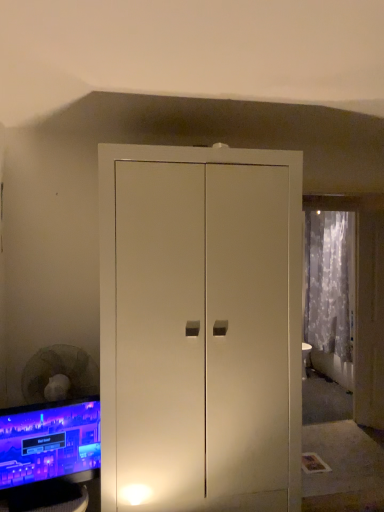
Locate an element on the screen. This screenshot has height=512, width=384. matte black monitor at lower left is located at coordinates (48, 453).

What do you see at coordinates (48, 453) in the screenshot? I see `matte black monitor at lower left` at bounding box center [48, 453].

Measure the distance between point (316, 320) and camera.

Point (316, 320) and camera are 5.34 meters apart.

Find the location of `translucent fabric curtain at right`. translucent fabric curtain at right is located at coordinates (328, 281).

What do you see at coordinates (328, 281) in the screenshot?
I see `translucent fabric curtain at right` at bounding box center [328, 281].

This screenshot has height=512, width=384. In order to click on matte black monitor at lower left in this screenshot , I will do `click(48, 453)`.

Which is more to the right, translucent fabric curtain at right or matte black monitor at lower left?

Positioned to the right is translucent fabric curtain at right.

In the scene shown: Is translucent fabric curtain at right in front of or behind matte black monitor at lower left in the image?

translucent fabric curtain at right is behind matte black monitor at lower left.

Which is behind, point (348, 346) or point (76, 443)?

The point (348, 346) is behind.

From the image's perspective, which is above, translucent fabric curtain at right or matte black monitor at lower left?

translucent fabric curtain at right.

From a real-world perspective, is translucent fabric curtain at right physically located above or below matte black monitor at lower left?

In terms of real-world spatial position, translucent fabric curtain at right is above matte black monitor at lower left.

Can you confirm if translucent fabric curtain at right is wider than matte black monitor at lower left?

Yes, translucent fabric curtain at right is wider than matte black monitor at lower left.

Considering the sizes of translucent fabric curtain at right and matte black monitor at lower left in the image, is translucent fabric curtain at right taller or shorter than matte black monitor at lower left?

translucent fabric curtain at right is taller than matte black monitor at lower left.

Who is smaller, translucent fabric curtain at right or matte black monitor at lower left?

Smaller between the two is matte black monitor at lower left.

Can we say translucent fabric curtain at right lies outside matte black monitor at lower left?

Indeed, translucent fabric curtain at right is completely outside matte black monitor at lower left.

Is translucent fabric curtain at right not close to matte black monitor at lower left?

Yes.

Is translucent fabric curtain at right looking in the opposite direction of matte black monitor at lower left?

translucent fabric curtain at right is not turned away from matte black monitor at lower left.

Looking at this image, can you tell me how much translucent fabric curtain at right and matte black monitor at lower left differ in facing direction?

102 degrees separate the facing orientations of translucent fabric curtain at right and matte black monitor at lower left.

This screenshot has height=512, width=384. I want to click on curtain that appears on the right of matte black monitor at lower left, so click(x=328, y=281).

Is matte black monitor at lower left to the right of translucent fabric curtain at right from the viewer's perspective?

In fact, matte black monitor at lower left is to the left of translucent fabric curtain at right.

Considering their positions, is matte black monitor at lower left located in front of or behind translucent fabric curtain at right?

Visually, matte black monitor at lower left is located in front of translucent fabric curtain at right.

Between point (12, 486) and point (345, 272), which one is positioned behind?

Positioned behind is point (345, 272).

From the image's perspective, which one is positioned lower, matte black monitor at lower left or translucent fabric curtain at right?

matte black monitor at lower left is shown below in the image.

From a real-world perspective, is matte black monitor at lower left beneath translucent fabric curtain at right?

Yes, from a real-world perspective, matte black monitor at lower left is under translucent fabric curtain at right.

Is matte black monitor at lower left wider or thinner than translucent fabric curtain at right?

matte black monitor at lower left is thinner than translucent fabric curtain at right.

Can you confirm if matte black monitor at lower left is taller than translucent fabric curtain at right?

No.

Can you confirm if matte black monitor at lower left is smaller than translucent fabric curtain at right?

Yes.

From the picture: Is matte black monitor at lower left positioned beyond the bounds of translucent fabric curtain at right?

Yes.

Is matte black monitor at lower left directly adjacent to translucent fabric curtain at right?

There is a gap between matte black monitor at lower left and translucent fabric curtain at right.

Does matte black monitor at lower left turn towards translucent fabric curtain at right?

No.

From the picture: Measure the distance from matte black monitor at lower left to translucent fabric curtain at right.

3.32 meters.

At what (x,y) coordinates should I click in order to perform the action: click on curtain behind the matte black monitor at lower left. Please return your answer as a coordinate pair (x, y). Looking at the image, I should click on (328, 281).

The height and width of the screenshot is (512, 384). What are the coordinates of `curtain above the matte black monitor at lower left (from a real-world perspective)` in the screenshot? It's located at (328, 281).

You are a GUI agent. You are given a task and a screenshot of the screen. Output one action in this format:
    pyautogui.click(x=<x>, y=<y>)
    Task: Click on the computer monitor that appears below the translucent fabric curtain at right (from the image's perspective)
    The height and width of the screenshot is (512, 384).
    Given the screenshot: What is the action you would take?
    pyautogui.click(x=48, y=453)